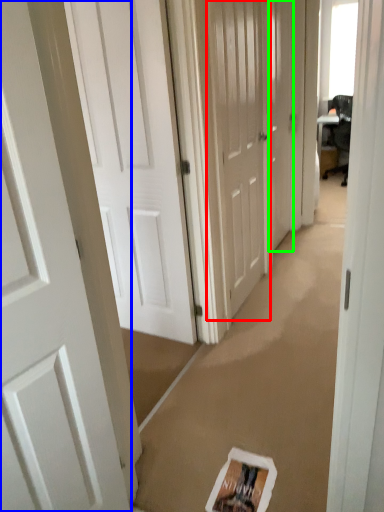
Question: Estimate the real-world distances between objects in this image. Which object is farther from door (highlighted by a red box), door (highlighted by a blue box) or door (highlighted by a green box)?

Choices:
 (A) door
 (B) door

Answer: (A)